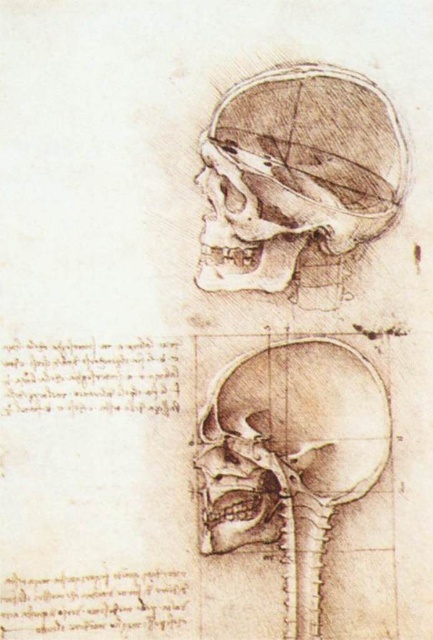
You are an art student analyzing the anatomical drawing of two skulls. The graphite pencil skull at upper center and the brown pencil sketch skull at center are both present. Which one has a greater width?

The graphite pencil skull at upper center might be wider than brown pencil sketch skull at center according to the description.

You are an art conservator examining a Leonardo da Vinci anatomical drawing of a skull. The drawing features a graphite pencil skull at upper center. If you are standing 1.47 meters away from the drawing, can you clearly see the fine hatching lines used to depict the texture of the bone?

The graphite pencil skull at upper center is 1.47 meters away from the camera, which means you are standing at the same distance as the camera. Since the fine hatching lines are part of the drawing, their visibility depends on the drawing size and your eyesight. However, the description does not provide information about the drawing size or the lines thickness, so it cannot be determined if they are clearly visible from that distance.

You are an art student analyzing the anatomical drawing of the human skull. You notice two skulls in the image. The first is the graphite pencil skull at upper center and the second is the brown pencil sketch skull at center. Based on the drawing, which of these two skulls is positioned more to the right side of the image?

The graphite pencil skull at upper center is positioned more to the right side of the image compared to the brown pencil sketch skull at center.